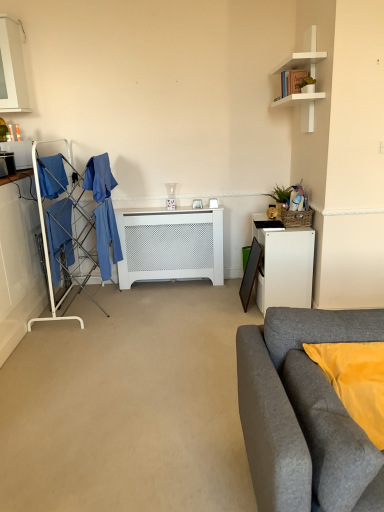
The image size is (384, 512). Identify the location of unoccupied region to the right of blue fabric drying rack at left. (135, 303).